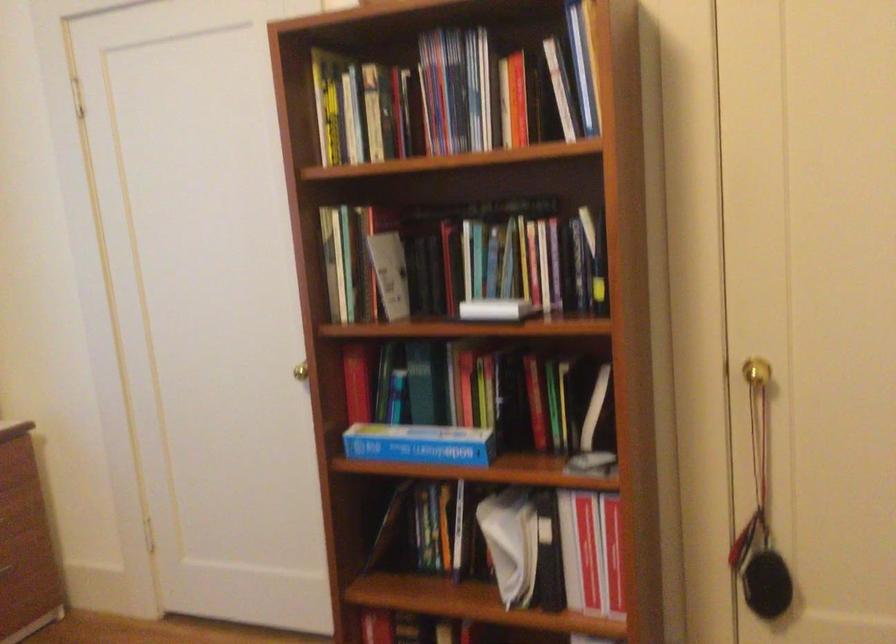
Locate an element on the screen. red binder is located at coordinates (613, 554).